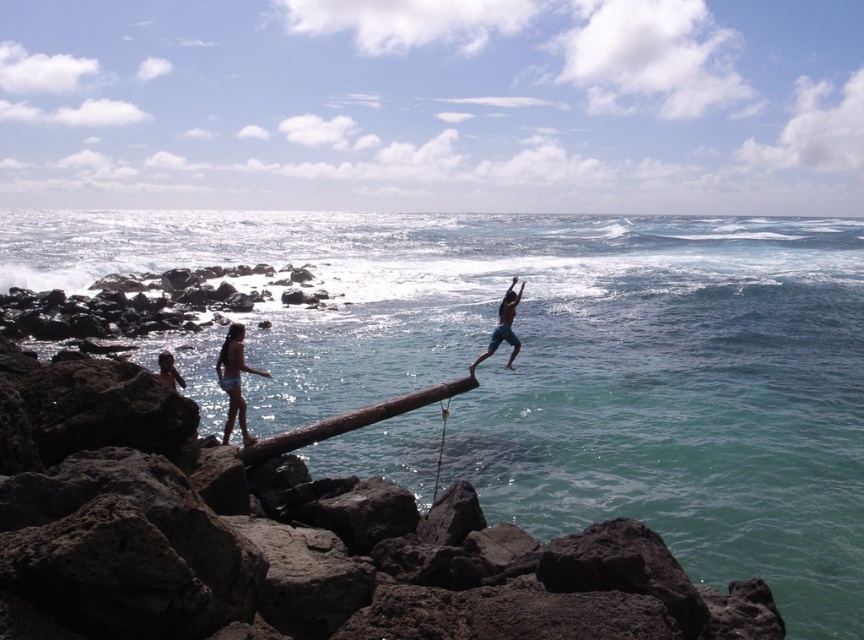
Identify the location of blue denim shorts at center. The image size is (864, 640). (503, 326).

In order to click on blue denim shorts at center in this screenshot , I will do point(503,326).

Does brown wood log at center lie behind blue denim shorts at center?

That is False.

Is brown wood log at center shorter than blue denim shorts at center?

Yes, brown wood log at center is shorter than blue denim shorts at center.

Is point (395, 401) closer to viewer compared to point (488, 353)?

Yes, it is in front of point (488, 353).

Where is `brown wood log at center`? This screenshot has width=864, height=640. brown wood log at center is located at coordinates (350, 420).

Does matte blue shorts at left have a greater height compared to light brown wooden stick at lower left?

Incorrect, matte blue shorts at left's height is not larger of light brown wooden stick at lower left's.

What are the coordinates of `matte blue shorts at left` in the screenshot? It's located at (234, 380).

Locate an element on the screen. matte blue shorts at left is located at coordinates (234, 380).

This screenshot has height=640, width=864. I want to click on matte blue shorts at left, so click(234, 380).